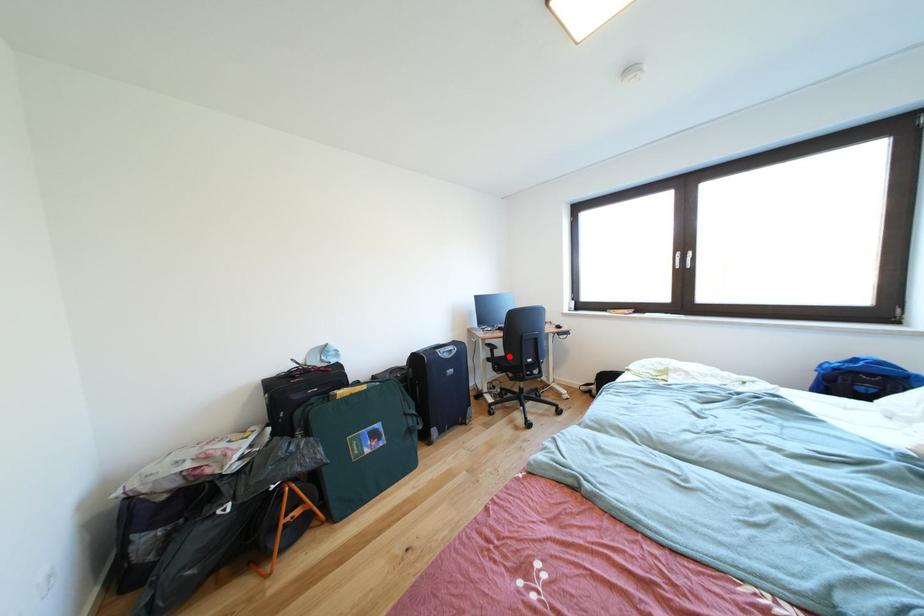
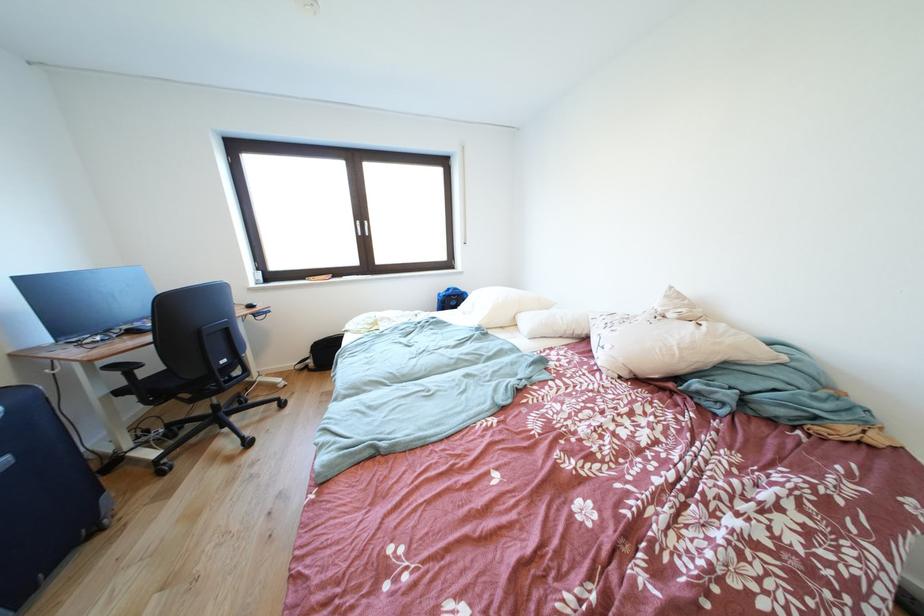
Question: I am providing you with two images of the same scene from different viewpoints. Given a red point in image1, look at the same physical point in image2. Is it:

Choices:
 (A) Closer to the viewpoint
 (B) Farther from the viewpoint

Answer: (A)